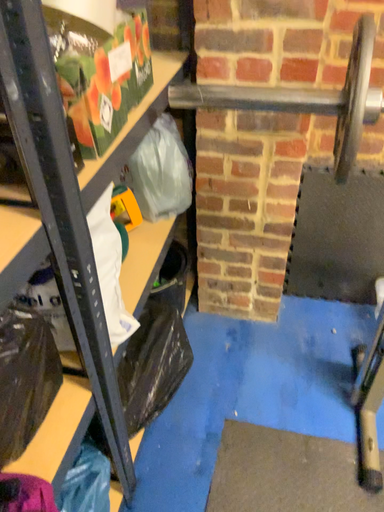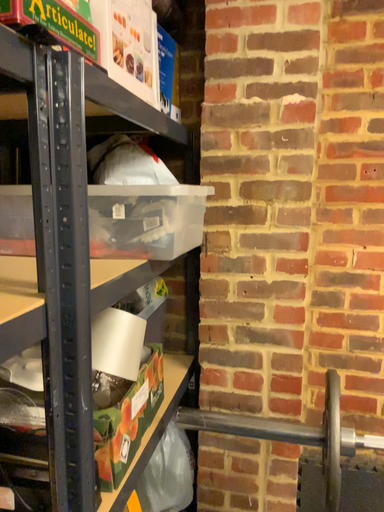
Question: Which way did the camera rotate in the video?

Choices:
 (A) rotated upward
 (B) rotated downward

Answer: (A)